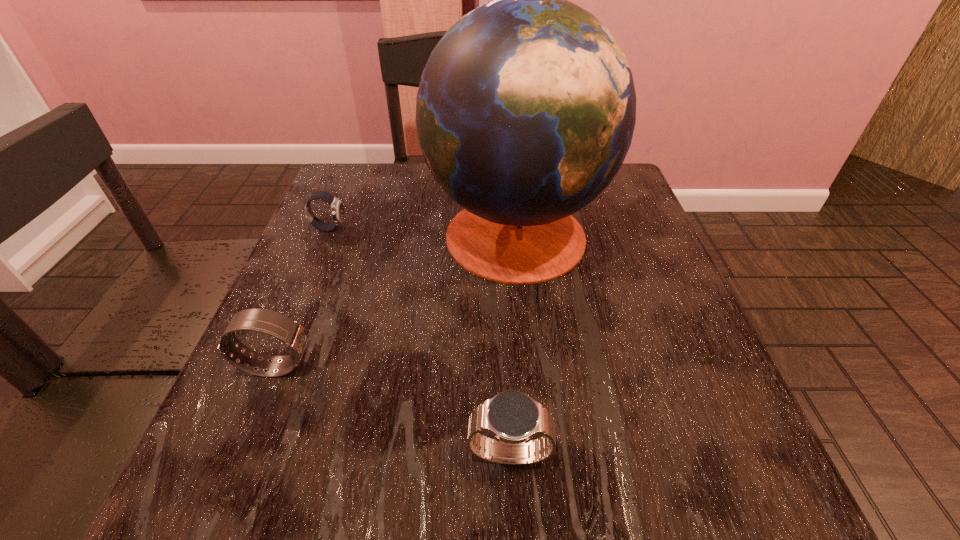
Identify the location of free space between the tallest object and the farthest watch. (422, 230).

Where is `free space between the second nearest watch and the globe`? The image size is (960, 540). free space between the second nearest watch and the globe is located at coordinates (396, 299).

Image resolution: width=960 pixels, height=540 pixels. Find the location of `object that is the third closest to the tallest object`. object that is the third closest to the tallest object is located at coordinates (512, 417).

At what (x,y) coordinates should I click in order to perform the action: click on object that stands as the third closest to the rightmost watch. Please return your answer as a coordinate pair (x, y). The width and height of the screenshot is (960, 540). Looking at the image, I should click on (337, 209).

Where is `watch that can be found as the closest to the globe`? watch that can be found as the closest to the globe is located at coordinates (337, 209).

You are a GUI agent. You are given a task and a screenshot of the screen. Output one action in this format:
    pyautogui.click(x=<x>, y=<y>)
    Task: Click on the watch object that ranks as the second closest to the nearest watch
    The width and height of the screenshot is (960, 540).
    Given the screenshot: What is the action you would take?
    pyautogui.click(x=337, y=209)

You are a GUI agent. You are given a task and a screenshot of the screen. Output one action in this format:
    pyautogui.click(x=<x>, y=<y>)
    Task: Click on the free location that satisfies the following two spatial constraints: 1. on the face of the nearest object; 2. on the right side of the second nearest object
    
    Given the screenshot: What is the action you would take?
    pyautogui.click(x=241, y=454)

This screenshot has width=960, height=540. I want to click on free space that satisfies the following two spatial constraints: 1. on the face of the nearest watch; 2. on the left side of the second nearest watch, so click(241, 454).

Image resolution: width=960 pixels, height=540 pixels. In order to click on free location that satisfies the following two spatial constraints: 1. on the face of the nearest watch; 2. on the left side of the shortest object in this screenshot , I will do `click(235, 454)`.

Locate an element on the screen. The image size is (960, 540). free space that satisfies the following two spatial constraints: 1. on the face of the farthest watch; 2. on the left side of the rightmost watch is located at coordinates 235,454.